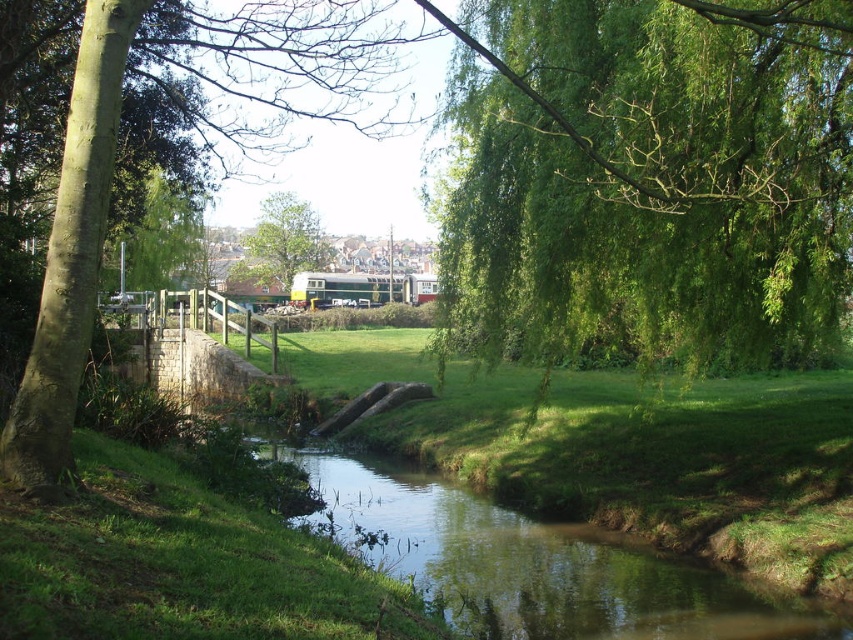
Question: Considering the relative positions of green grass at center and green leafy tree at upper center in the image provided, where is green grass at center located with respect to green leafy tree at upper center?

Choices:
 (A) above
 (B) below

Answer: (B)

Question: Which point is closer to the camera taking this photo?

Choices:
 (A) (624, 221)
 (B) (206, 51)

Answer: (A)

Question: Estimate the real-world distances between objects in this image. Which object is farther from the green leafy tree at upper right?

Choices:
 (A) green leafy tree at upper left
 (B) green leafy tree at left
 (C) green leafy tree at upper center
 (D) green grass at center

Answer: (C)

Question: Which of the following is the farthest from the observer?

Choices:
 (A) green leafy tree at upper right
 (B) green leafy tree at upper center
 (C) green leafy tree at upper left
 (D) green leafy tree at left

Answer: (B)

Question: Where is green leafy tree at upper right located in relation to green leafy tree at upper center in the image?

Choices:
 (A) right
 (B) left

Answer: (A)

Question: Is green leafy tree at left smaller than green leafy tree at upper left?

Choices:
 (A) no
 (B) yes

Answer: (A)